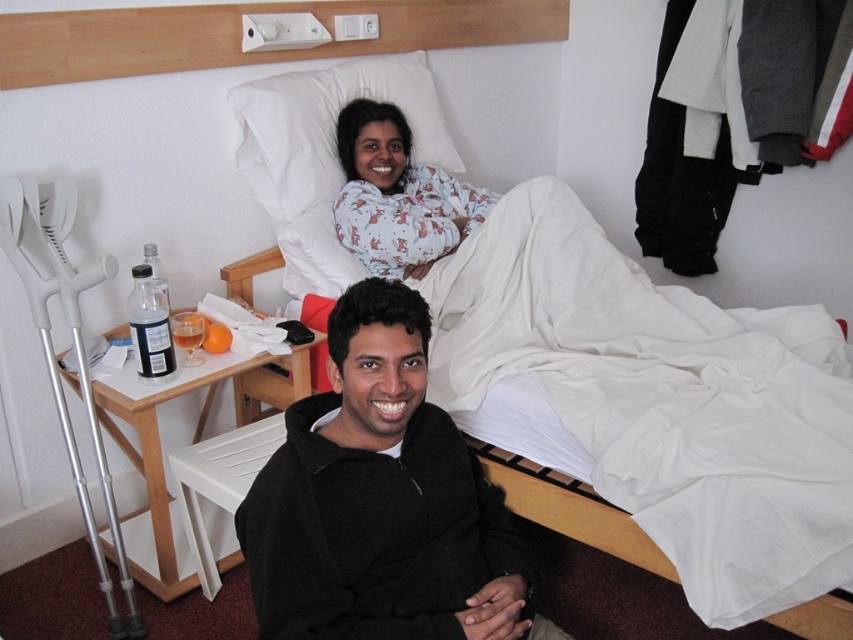
You are a hotel staff member checking the room. You need to determine if the white soft pillow at upper center can be placed inside the printed cotton pajamas at upper center. Based on their sizes, what would you conclude?

The white soft pillow at upper center is bigger than the printed cotton pajamas at upper center, so the pillow cannot be placed inside the pajamas.

You are a delivery person who needs to place a package on the floor next to the white fabric hospital bed at center. According to the coordinates provided, where should you place the package?

The white fabric hospital bed at center is located at coordinates point [656,401], so you should place the package on the floor near those coordinates.

You are a hotel housekeeper who needs to place a 6 inch wide decorative pillow on the bed where the printed cotton pajamas at upper center and the white soft pillow at upper center are located. Can you fit the new pillow between them without moving any existing items?

The white soft pillow at upper center and printed cotton pajamas at upper center are 5.41 inches apart from each other. Since the new decorative pillow is 6 inches wide, it cannot fit between them without moving existing items because the available space is smaller than the pillow.